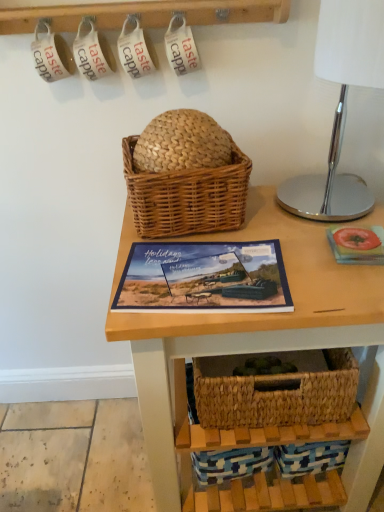
Question: Is woven wood table at center in front of polished chrome table lamp at right?

Choices:
 (A) yes
 (B) no

Answer: (B)

Question: Considering the relative sizes of woven wood table at center and polished chrome table lamp at right in the image provided, is woven wood table at center taller than polished chrome table lamp at right?

Choices:
 (A) no
 (B) yes

Answer: (B)

Question: Is woven wood table at center to the left of polished chrome table lamp at right from the viewer's perspective?

Choices:
 (A) no
 (B) yes

Answer: (B)

Question: Can you confirm if woven wood table at center is smaller than polished chrome table lamp at right?

Choices:
 (A) yes
 (B) no

Answer: (B)

Question: Is woven wood table at center beside polished chrome table lamp at right?

Choices:
 (A) no
 (B) yes

Answer: (A)

Question: Would you say polished chrome table lamp at right is part of woven wood table at center's contents?

Choices:
 (A) yes
 (B) no

Answer: (B)

Question: Is woven brown picnic basket at center completely or partially inside woven wood table at center?

Choices:
 (A) no
 (B) yes

Answer: (A)

Question: Is woven wood table at center smaller than woven brown picnic basket at center?

Choices:
 (A) yes
 (B) no

Answer: (B)

Question: From the image's perspective, is woven wood table at center over woven brown picnic basket at center?

Choices:
 (A) no
 (B) yes

Answer: (A)

Question: Considering the relative sizes of woven wood table at center and woven brown picnic basket at center in the image provided, is woven wood table at center shorter than woven brown picnic basket at center?

Choices:
 (A) yes
 (B) no

Answer: (B)

Question: Is woven wood table at center positioned far away from woven brown picnic basket at center?

Choices:
 (A) no
 (B) yes

Answer: (A)

Question: Can you confirm if woven wood table at center is taller than woven brown picnic basket at center?

Choices:
 (A) yes
 (B) no

Answer: (A)

Question: From the image's perspective, is matte blue book at center on top of woven brown picnic basket at center?

Choices:
 (A) yes
 (B) no

Answer: (B)